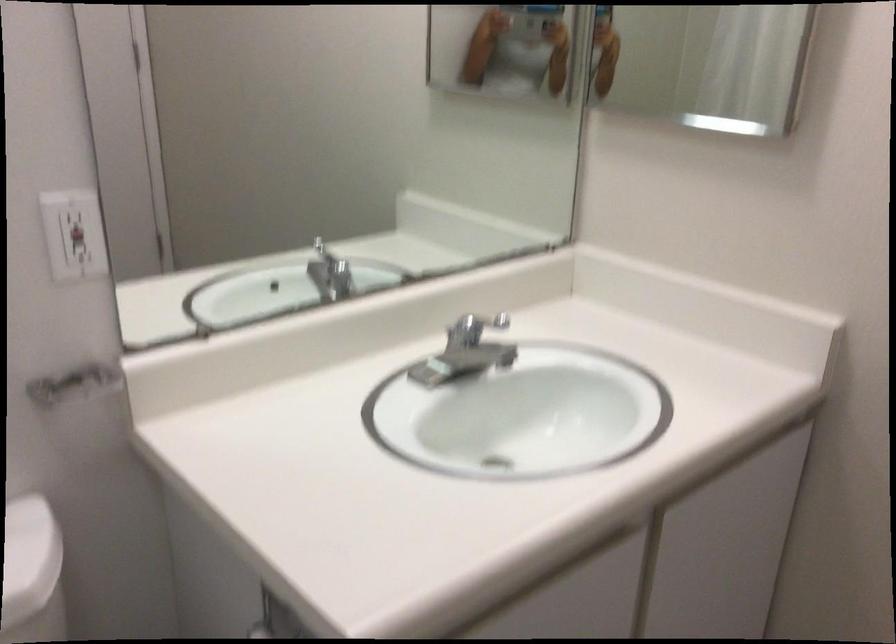
Describe the element at coordinates (76, 234) in the screenshot. I see `a red outlet button` at that location.